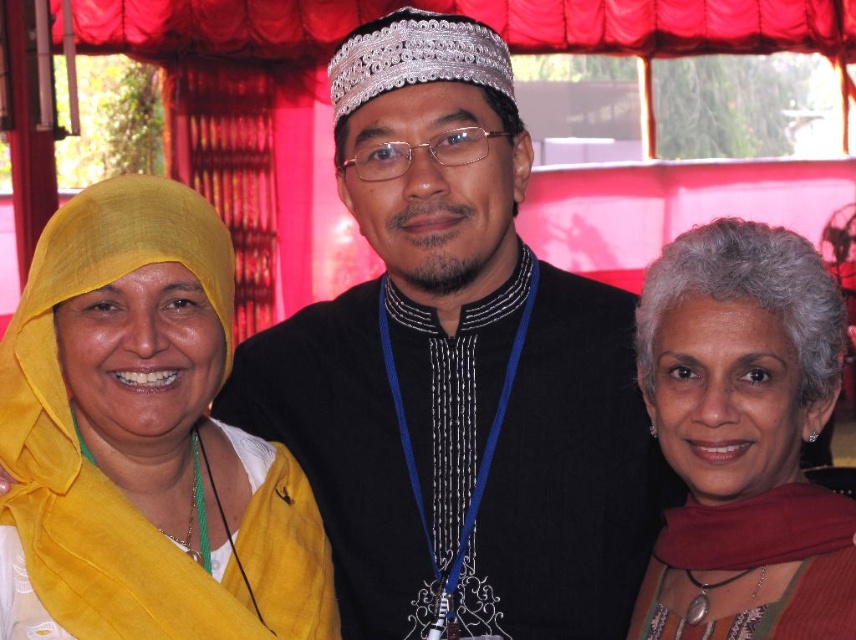
Is point (141, 374) more distant than point (732, 310)?

That is True.

The width and height of the screenshot is (856, 640). In order to click on matte yellow scarf at left in this screenshot , I will do `click(143, 442)`.

The width and height of the screenshot is (856, 640). I want to click on matte yellow scarf at left, so click(x=143, y=442).

Locate an element on the screen. The image size is (856, 640). black fabric at center is located at coordinates (456, 371).

You are a GUI agent. You are given a task and a screenshot of the screen. Output one action in this format:
    pyautogui.click(x=<x>, y=<y>)
    Task: Click on the black fabric at center
    The height and width of the screenshot is (640, 856).
    Given the screenshot: What is the action you would take?
    pyautogui.click(x=456, y=371)

Which is more to the right, black fabric at center or matte red scarf at right?

Positioned to the right is matte red scarf at right.

Image resolution: width=856 pixels, height=640 pixels. What do you see at coordinates (456, 371) in the screenshot?
I see `black fabric at center` at bounding box center [456, 371].

Is point (426, 144) farther from viewer compared to point (779, 497)?

Yes, it is behind point (779, 497).

Image resolution: width=856 pixels, height=640 pixels. In order to click on black fabric at center in this screenshot , I will do `click(456, 371)`.